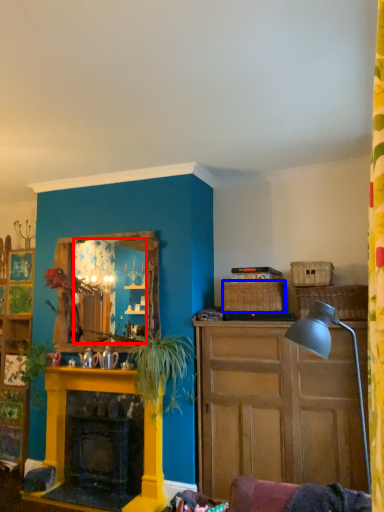
Question: Which of the following is the closest to the observer, mirror (highlighted by a red box) or picnic basket (highlighted by a blue box)?

Choices:
 (A) mirror
 (B) picnic basket

Answer: (B)